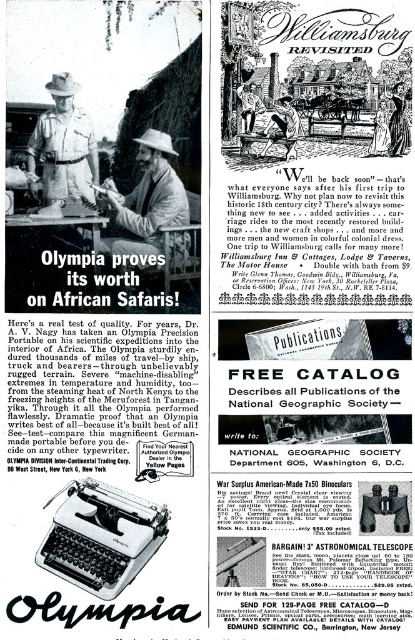
Is khaki cotton hat at center closer to the viewer compared to khaki uniform at center?

No, khaki cotton hat at center is behind khaki uniform at center.

Which is more to the right, khaki cotton hat at center or khaki uniform at center?

From the viewer's perspective, khaki cotton hat at center appears more on the right side.

Describe the element at coordinates (148, 205) in the screenshot. I see `khaki cotton hat at center` at that location.

The image size is (415, 640). I want to click on khaki cotton hat at center, so click(148, 205).